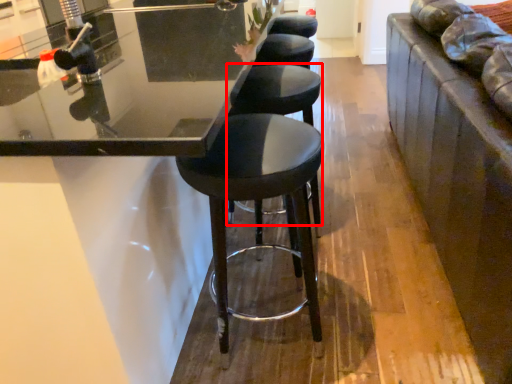
Question: From the image's perspective, where is stool (annotated by the red box) located in relation to stool in the image?

Choices:
 (A) below
 (B) above

Answer: (B)